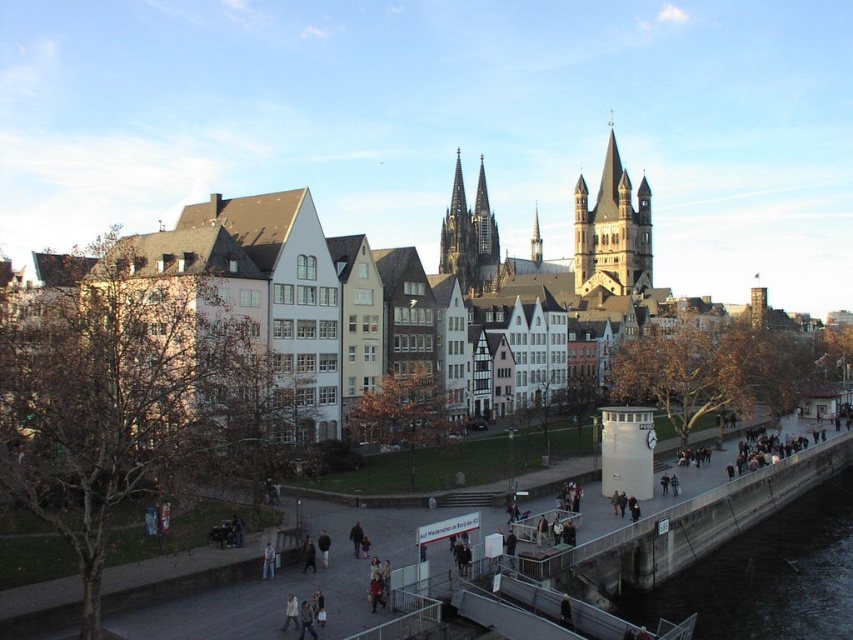
Can you confirm if dark gray concrete river at lower right is positioned below dark gray stone tower at center?

Yes.

In the scene shown: Is dark gray concrete river at lower right further to camera compared to dark gray stone tower at center?

No, dark gray concrete river at lower right is in front of dark gray stone tower at center.

Which is behind, point (798, 592) or point (485, 182)?

Point (485, 182)

Where is `dark gray concrete river at lower right`? dark gray concrete river at lower right is located at coordinates (767, 577).

Is white stone buildings at center smaller than golden stone tower at center?

No, white stone buildings at center is not smaller than golden stone tower at center.

Is white stone buildings at center further to the viewer compared to golden stone tower at center?

No, it is in front of golden stone tower at center.

Who is more forward, [242,312] or [648,266]?

Positioned in front is point [242,312].

The width and height of the screenshot is (853, 640). Identify the location of white stone buildings at center. (273, 289).

Is golden stone tower at center further to the viewer compared to dark gray stone tower at center?

No, golden stone tower at center is in front of dark gray stone tower at center.

Does golden stone tower at center appear on the right side of dark gray stone tower at center?

Yes, golden stone tower at center is to the right of dark gray stone tower at center.

Is point (643, 259) more distant than point (440, 236)?

No, it is in front of (440, 236).

Find the location of a particular element. This screenshot has width=853, height=640. golden stone tower at center is located at coordinates pyautogui.click(x=612, y=230).